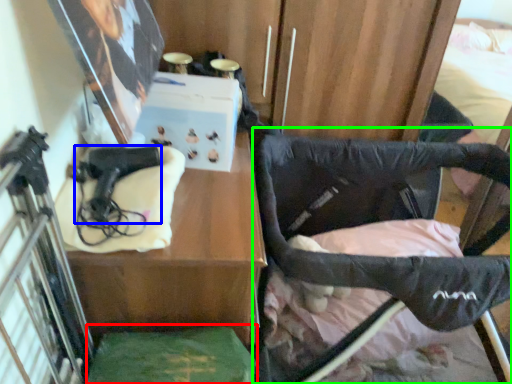
Question: Which object is the farthest from wide (highlighted by a red box)? Choose among these: handgun (highlighted by a blue box) or furniture (highlighted by a green box).

Choices:
 (A) handgun
 (B) furniture

Answer: (B)